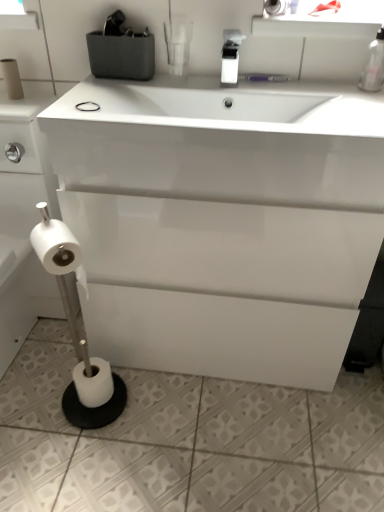
Identify the location of vacant space that is to the left of white glossy soap dispenser at upper center, which is counted as the 1th bottle, starting from the left. This screenshot has width=384, height=512. (170, 87).